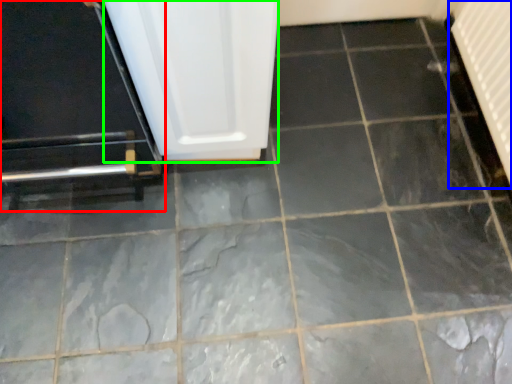
Question: Which object is positioned farthest from door (highlighted by a red box)? Select from radiator (highlighted by a blue box) and screen door (highlighted by a green box).

Choices:
 (A) radiator
 (B) screen door

Answer: (A)